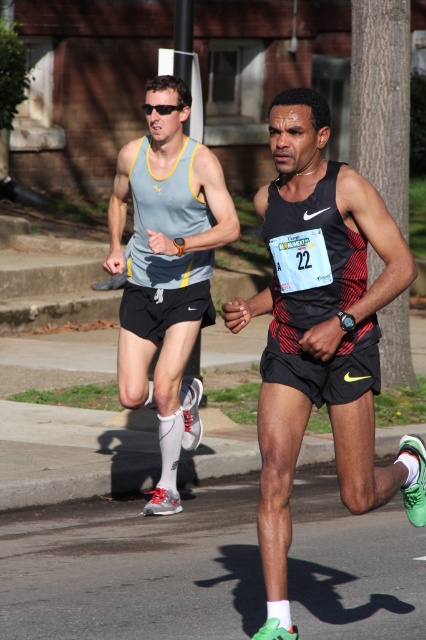
Question: Which object appears closest to the camera in this image?

Choices:
 (A) matte gray tank top at left
 (B) green matte running shoe at right

Answer: (B)

Question: Which point is closer to the camera?

Choices:
 (A) (132, 192)
 (B) (379, 388)

Answer: (B)

Question: Is green matte running shoe at right thinner than matte gray tank top at left?

Choices:
 (A) no
 (B) yes

Answer: (A)

Question: Which object is farther from the camera taking this photo?

Choices:
 (A) matte gray tank top at left
 (B) green matte running shoe at right

Answer: (A)

Question: Can you confirm if green matte running shoe at right is positioned above matte gray tank top at left?

Choices:
 (A) yes
 (B) no

Answer: (B)

Question: Can you confirm if green matte running shoe at right is bigger than matte gray tank top at left?

Choices:
 (A) yes
 (B) no

Answer: (A)